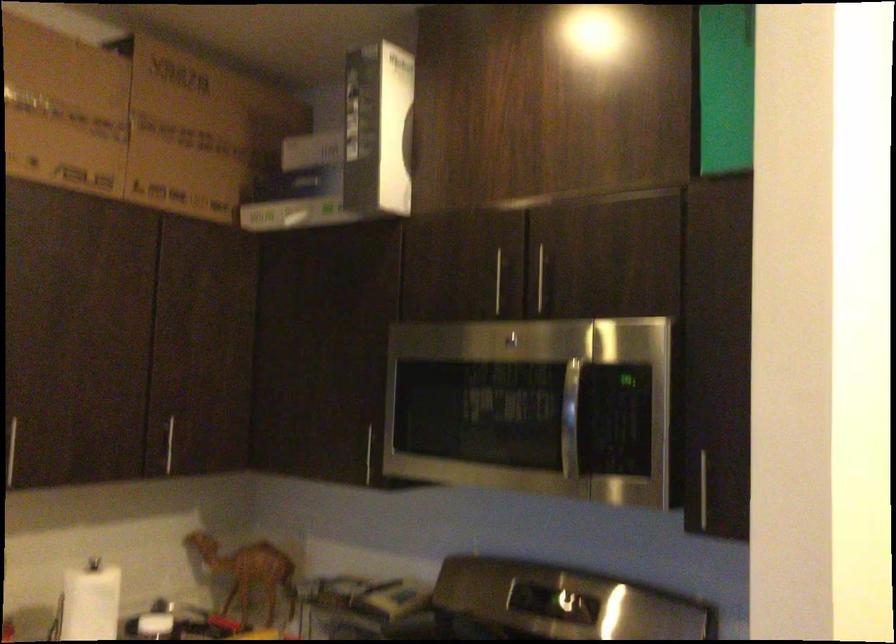
Which object does [90,601] point to?

This point indicates the white paper towel roll.